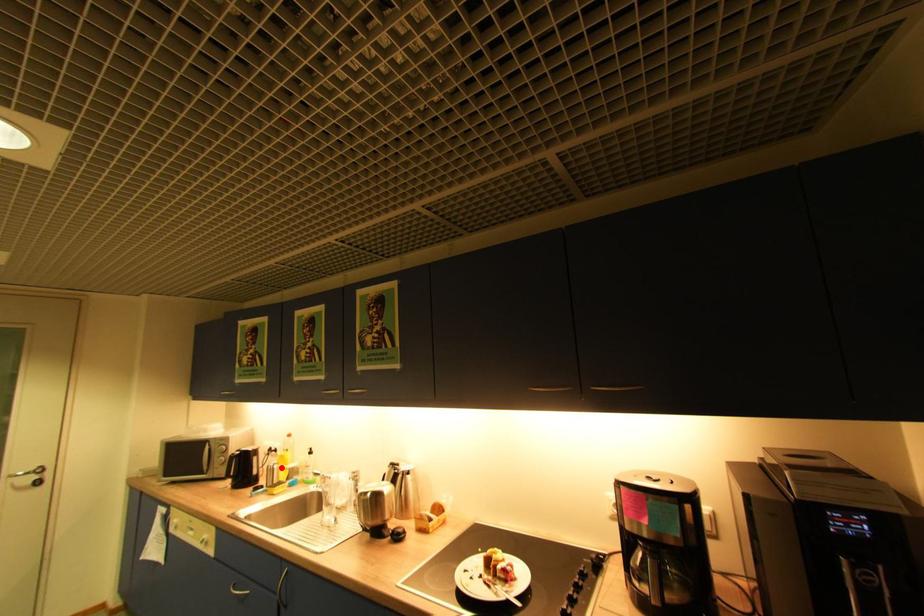
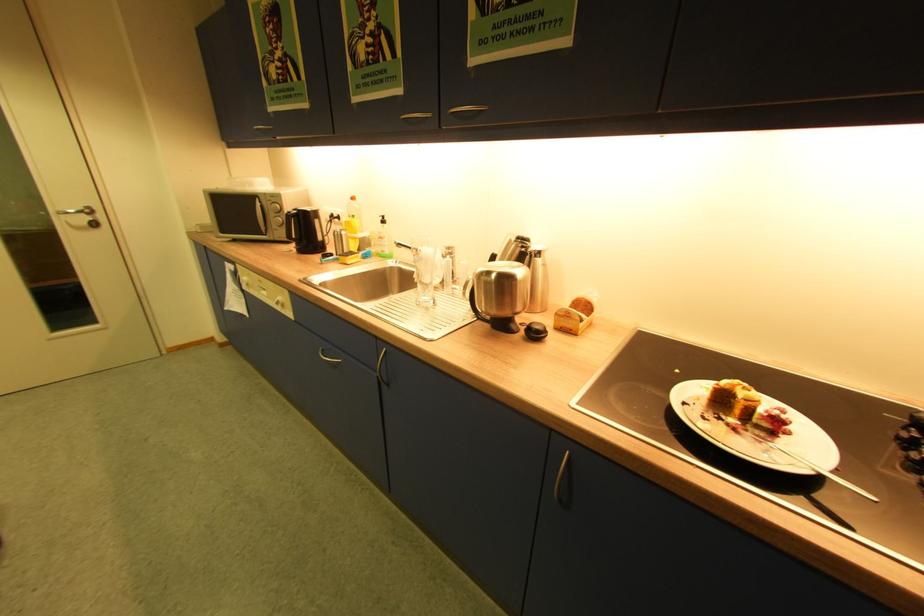
Question: A red point is marked in image1. In image2, is the corresponding 3D point closer to the camera or farther? Reply with the corresponding letter.

Choices:
 (A) The corresponding 3D point is closer.
 (B) The corresponding 3D point is farther.

Answer: (A)